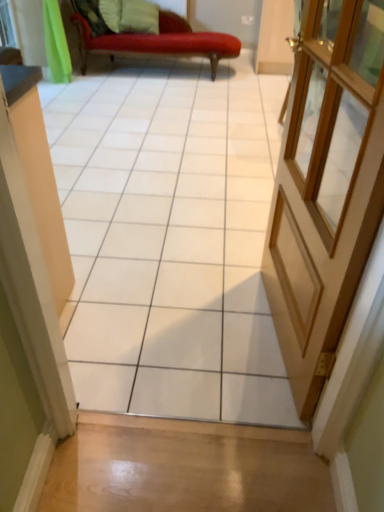
Question: From the image's perspective, is green fabric pillow at upper center positioned above or below light brown wooden door at right?

Choices:
 (A) above
 (B) below

Answer: (A)

Question: Is green fabric pillow at upper center wider or thinner than light brown wooden door at right?

Choices:
 (A) thin
 (B) wide

Answer: (B)

Question: Which object is positioned farthest from the green fabric pillow at upper center?

Choices:
 (A) light brown wooden door at right
 (B) white glossy tile at center

Answer: (A)

Question: Based on their relative distances, which object is farther from the light brown wooden door at right?

Choices:
 (A) white glossy tile at center
 (B) green fabric pillow at upper center

Answer: (B)